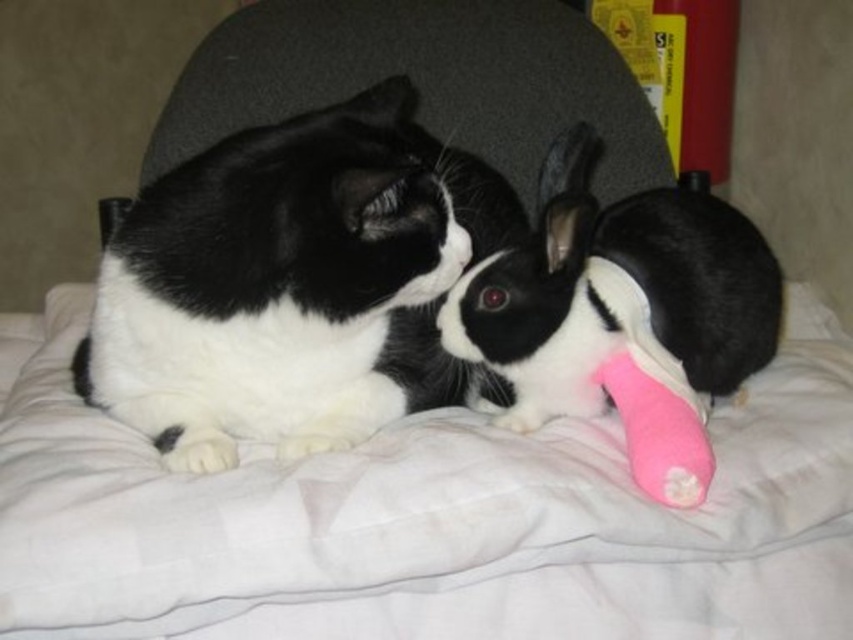
Can you confirm if black/white fur cat at upper left is positioned above pink rubber toy at center?

Indeed, black/white fur cat at upper left is positioned over pink rubber toy at center.

Can you confirm if black/white fur cat at upper left is positioned to the left of pink rubber toy at center?

Indeed, black/white fur cat at upper left is positioned on the left side of pink rubber toy at center.

Locate an element on the screen. The image size is (853, 640). black/white fur cat at upper left is located at coordinates (291, 284).

This screenshot has width=853, height=640. In order to click on black/white fur cat at upper left in this screenshot , I will do `click(291, 284)`.